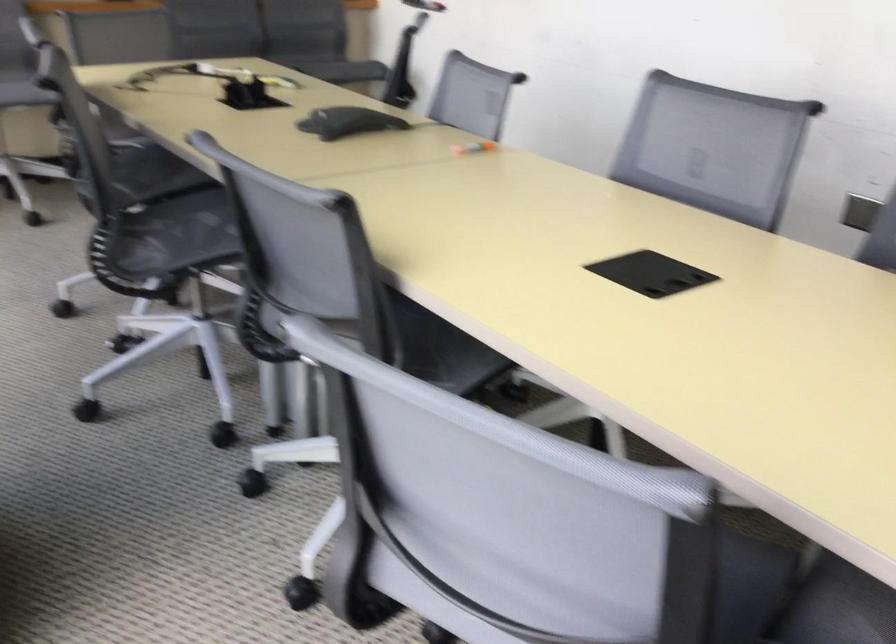
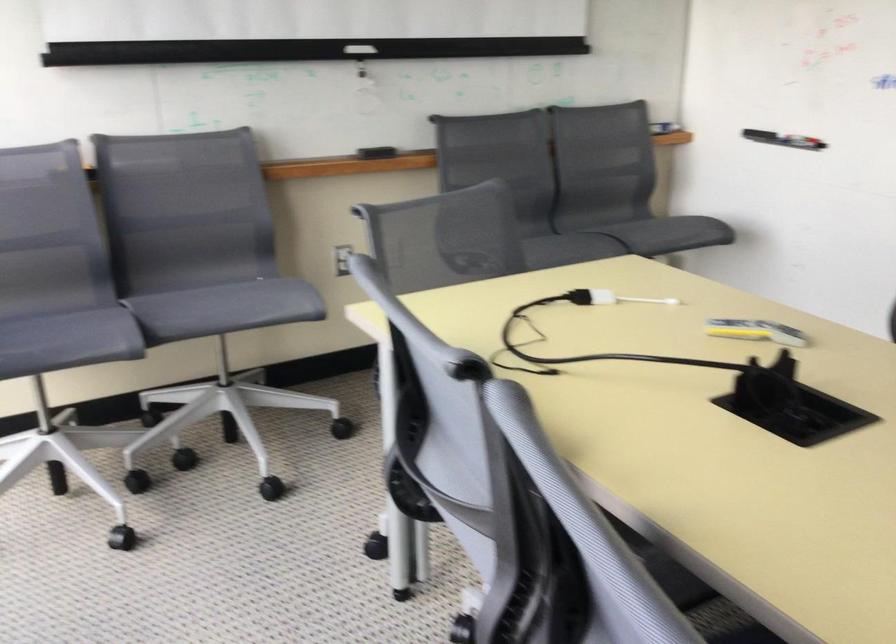
Which direction would the cameraman need to move to produce the second image?

The cameraman walked toward left, forward.